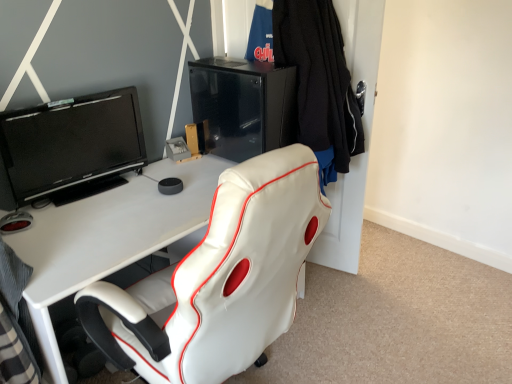
Question: Does matte black entertainment center at upper center have a lesser width compared to black glossy/file cabinet at upper center?

Choices:
 (A) yes
 (B) no

Answer: (B)

Question: Is matte black entertainment center at upper center to the right of black glossy/file cabinet at upper center from the viewer's perspective?

Choices:
 (A) no
 (B) yes

Answer: (A)

Question: Is matte black entertainment center at upper center at the left side of black glossy/file cabinet at upper center?

Choices:
 (A) no
 (B) yes

Answer: (B)

Question: Can you see matte black entertainment center at upper center touching black glossy/file cabinet at upper center?

Choices:
 (A) no
 (B) yes

Answer: (A)

Question: Is matte black entertainment center at upper center positioned far away from black glossy/file cabinet at upper center?

Choices:
 (A) yes
 (B) no

Answer: (B)

Question: Considering the relative sizes of matte black entertainment center at upper center and black glossy/file cabinet at upper center in the image provided, is matte black entertainment center at upper center shorter than black glossy/file cabinet at upper center?

Choices:
 (A) no
 (B) yes

Answer: (A)

Question: Does matte black entertainment center at upper center have a lesser width compared to black glossy screen at upper left?

Choices:
 (A) yes
 (B) no

Answer: (B)

Question: Is matte black entertainment center at upper center at the right side of black glossy screen at upper left?

Choices:
 (A) no
 (B) yes

Answer: (B)

Question: Is the position of matte black entertainment center at upper center less distant than that of black glossy screen at upper left?

Choices:
 (A) no
 (B) yes

Answer: (B)

Question: From the image's perspective, is matte black entertainment center at upper center on black glossy screen at upper left?

Choices:
 (A) no
 (B) yes

Answer: (A)

Question: Is the surface of matte black entertainment center at upper center in direct contact with black glossy screen at upper left?

Choices:
 (A) no
 (B) yes

Answer: (A)

Question: Can you confirm if matte black entertainment center at upper center is taller than black glossy screen at upper left?

Choices:
 (A) yes
 (B) no

Answer: (A)

Question: From the image's perspective, is black knitted sweater at upper right on top of black glossy screen at upper left?

Choices:
 (A) yes
 (B) no

Answer: (A)